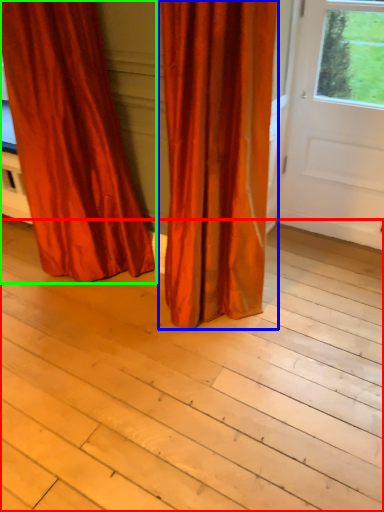
Question: Which is farther away from plank (highlighted by a red box)? curtain (highlighted by a blue box) or curtain (highlighted by a green box)?

Choices:
 (A) curtain
 (B) curtain

Answer: (B)